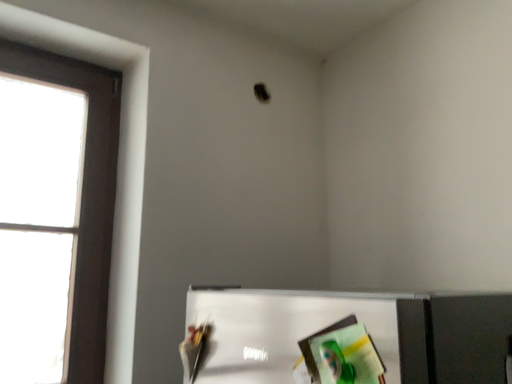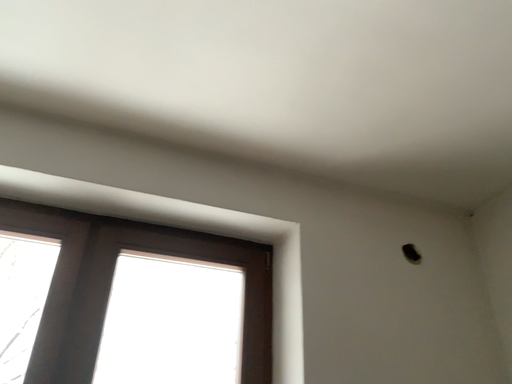
Question: Which way did the camera rotate in the video?

Choices:
 (A) rotated downward
 (B) rotated upward

Answer: (B)